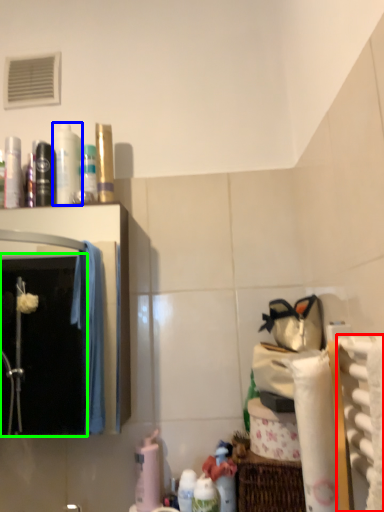
Question: Which object is positioned farthest from bath towel (highlighted by a red box)? Select from mouthwash (highlighted by a blue box) and mirror (highlighted by a green box).

Choices:
 (A) mouthwash
 (B) mirror

Answer: (B)